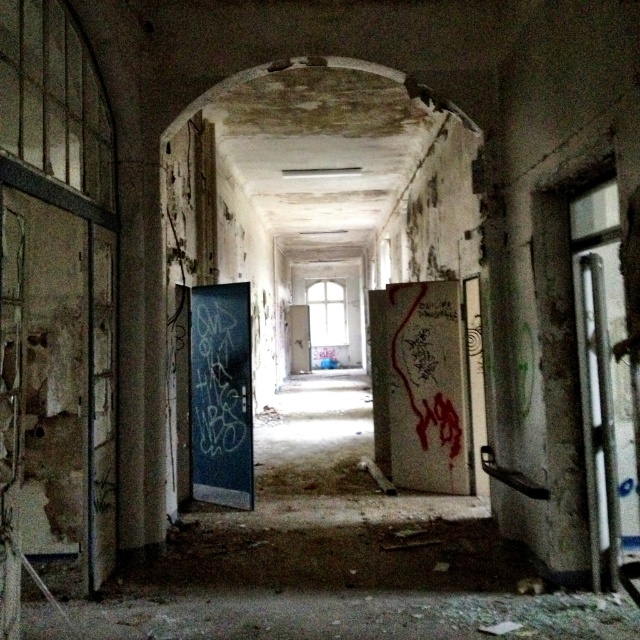
Who is more forward, (232, 417) or (296, 344)?

Point (232, 417) is more forward.

Between dark blue painted door at center and white matte door at center, which one is positioned lower?

white matte door at center is below.

Measure the distance between dark blue painted door at center and camera.

dark blue painted door at center is 6.23 meters away from camera.

The height and width of the screenshot is (640, 640). What are the coordinates of `dark blue painted door at center` in the screenshot? It's located at (220, 396).